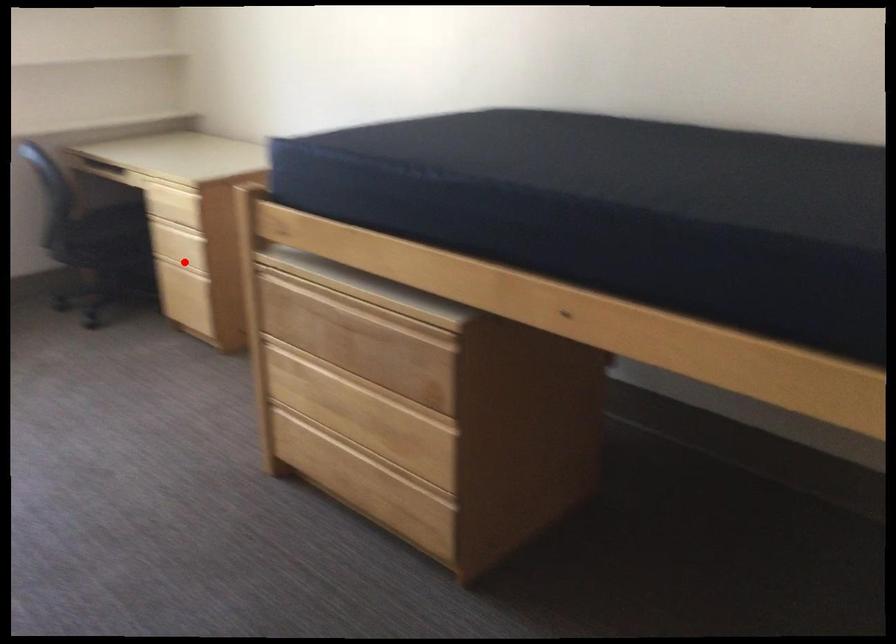
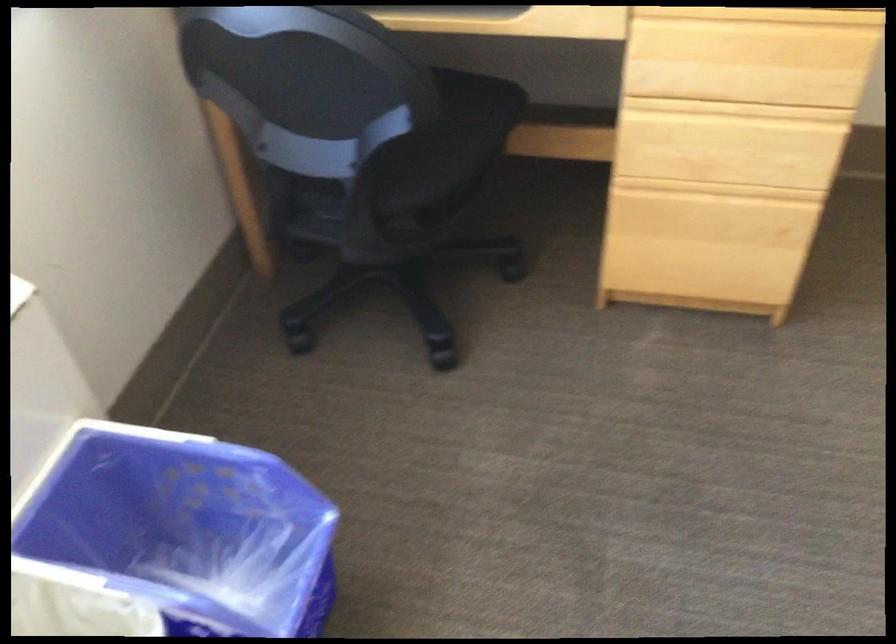
Question: I am providing you with two images of the same scene from different viewpoints. Image1 has a red point marked. In image2, the corresponding 3D location appears at what relative position? Reply with the corresponding letter.

Choices:
 (A) Closer
 (B) Farther

Answer: (A)